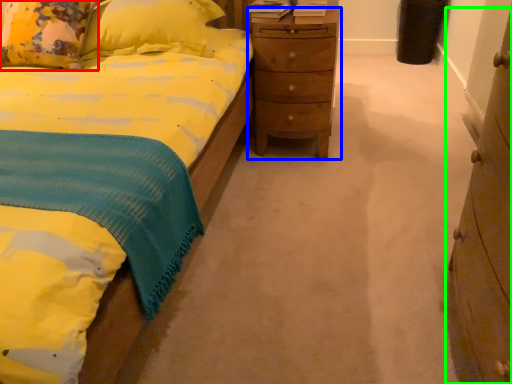
Question: Considering the real-world distances, which object is farthest from pillow (highlighted by a red box)? nightstand (highlighted by a blue box) or chest of drawers (highlighted by a green box)?

Choices:
 (A) nightstand
 (B) chest of drawers

Answer: (B)